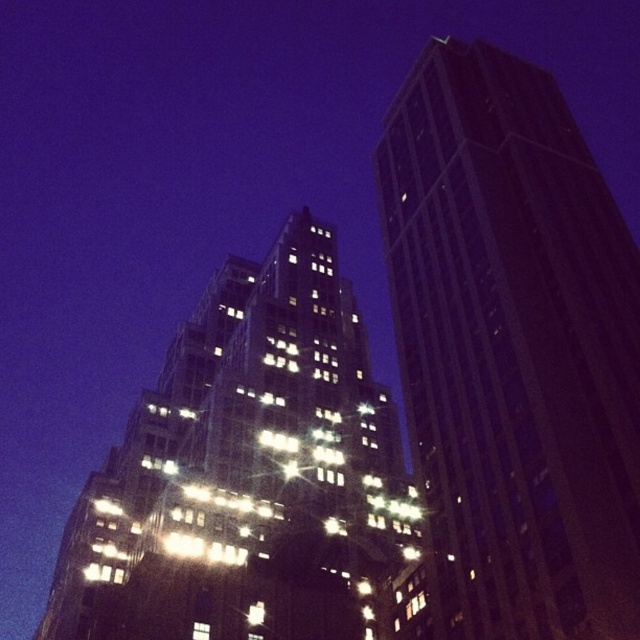
Who is shorter, dark glass skyscraper at right or shiny glass building at center?

With less height is shiny glass building at center.

Image resolution: width=640 pixels, height=640 pixels. What are the coordinates of `dark glass skyscraper at right` in the screenshot? It's located at (513, 349).